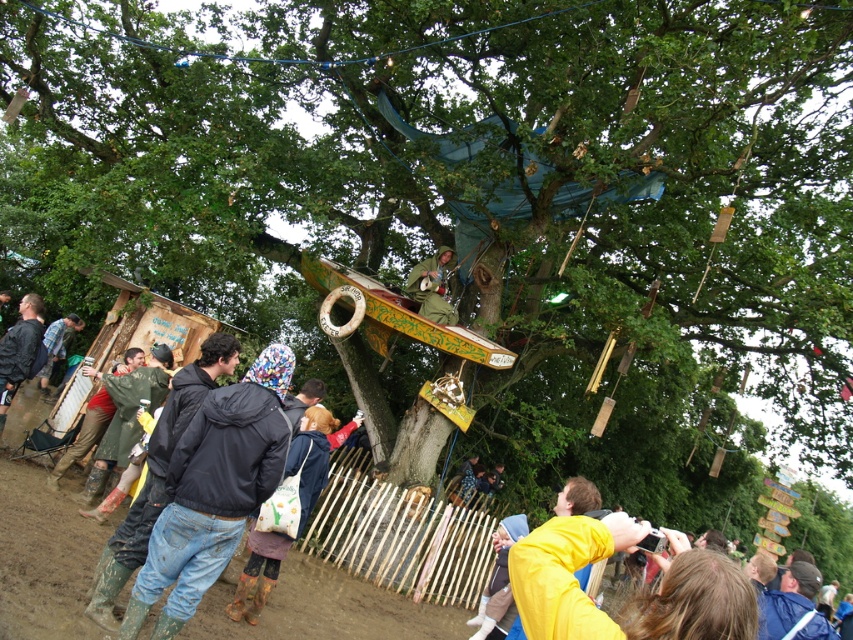
Consider the image. You are organizing a small event and need to place a decorative banner between the wooden at center and the black matte jacket at left. Since the banner requires a wider space, which object should you place the banner next to?

The wooden at center has a larger width than the black matte jacket at left, so you should place the banner next to the wooden at center to accommodate its width requirement.

You are a photographer setting up a tripod at the festival. You need to place your equipment between the wet rubber boots at lower left and the ripped denim jacket at lower left. Since both items are at the lower left, which one should you move to make space?

The wet rubber boots at lower left is larger in size than the ripped denim jacket at lower left, so you should move the wet rubber boots at lower left to make space.